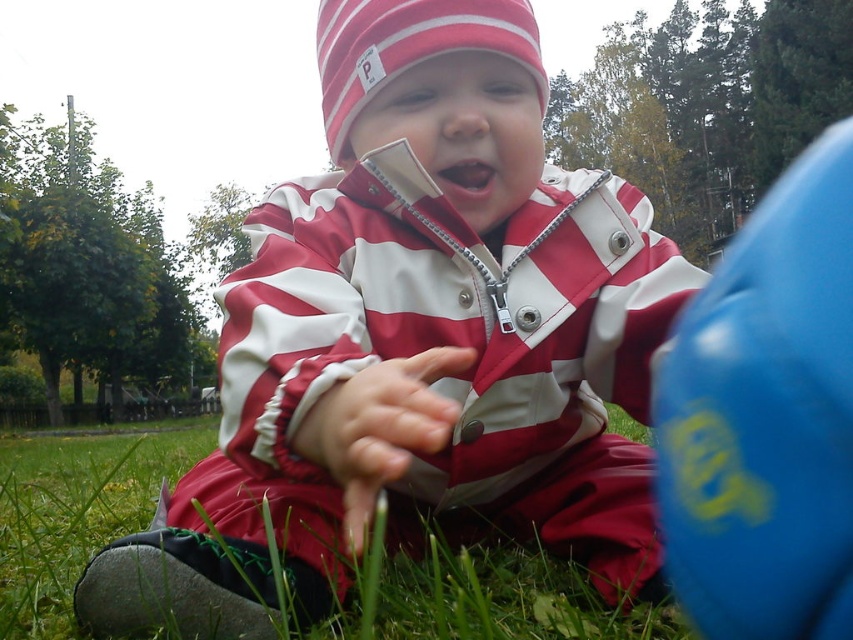
Question: Can you confirm if matte striped jacket at center is positioned above bright red lips at center?

Choices:
 (A) no
 (B) yes

Answer: (A)

Question: Which object is closer to the camera taking this photo?

Choices:
 (A) blue rubber ball at right
 (B) green grass at lower center
 (C) bright red lips at center
 (D) matte striped jacket at center

Answer: (A)

Question: Which point is farther to the camera?

Choices:
 (A) (793, 294)
 (B) (364, 81)
 (C) (569, 349)
 (D) (560, 611)

Answer: (C)

Question: Which point is closer to the camera taking this photo?

Choices:
 (A) (514, 582)
 (B) (465, 164)
 (C) (693, 426)

Answer: (C)

Question: Is blue rubber ball at right above green grass at lower center?

Choices:
 (A) yes
 (B) no

Answer: (A)

Question: Can you confirm if green grass at lower center is bigger than bright red lips at center?

Choices:
 (A) yes
 (B) no

Answer: (A)